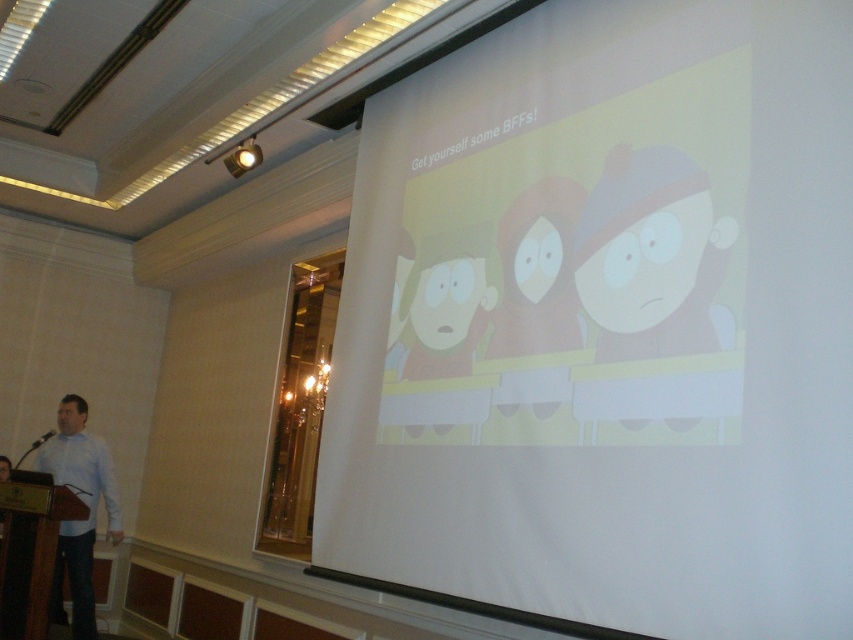
Question: Is the position of white shirt at left less distant than that of white matte shirt at left?

Choices:
 (A) no
 (B) yes

Answer: (A)

Question: In this image, where is white shirt at left located relative to white matte shirt at left?

Choices:
 (A) below
 (B) above

Answer: (A)

Question: Does white shirt at left have a larger size compared to white matte shirt at left?

Choices:
 (A) yes
 (B) no

Answer: (A)

Question: Which of the following is the closest to the observer?

Choices:
 (A) white matte shirt at left
 (B) white shirt at left

Answer: (A)

Question: Which point is closer to the camera?

Choices:
 (A) (59, 451)
 (B) (80, 442)

Answer: (A)